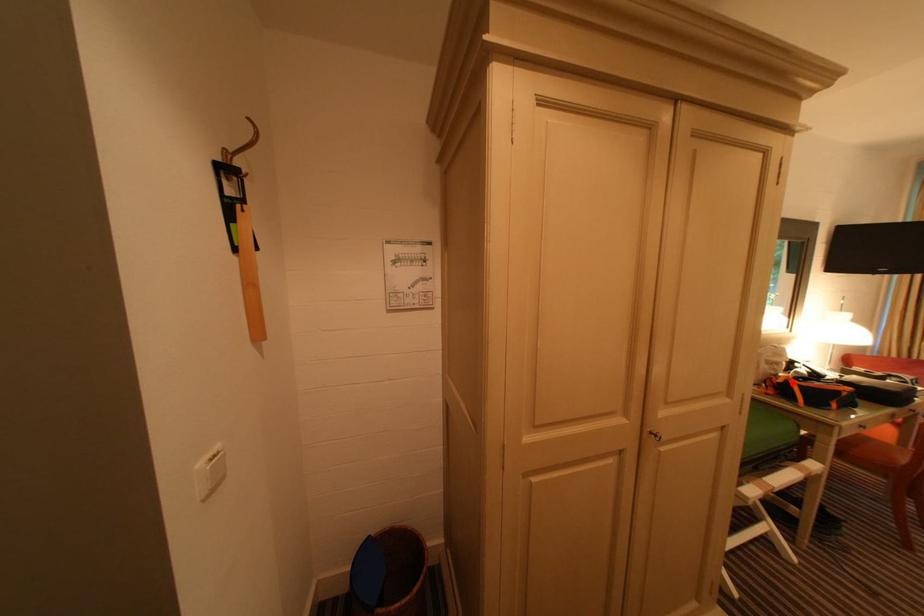
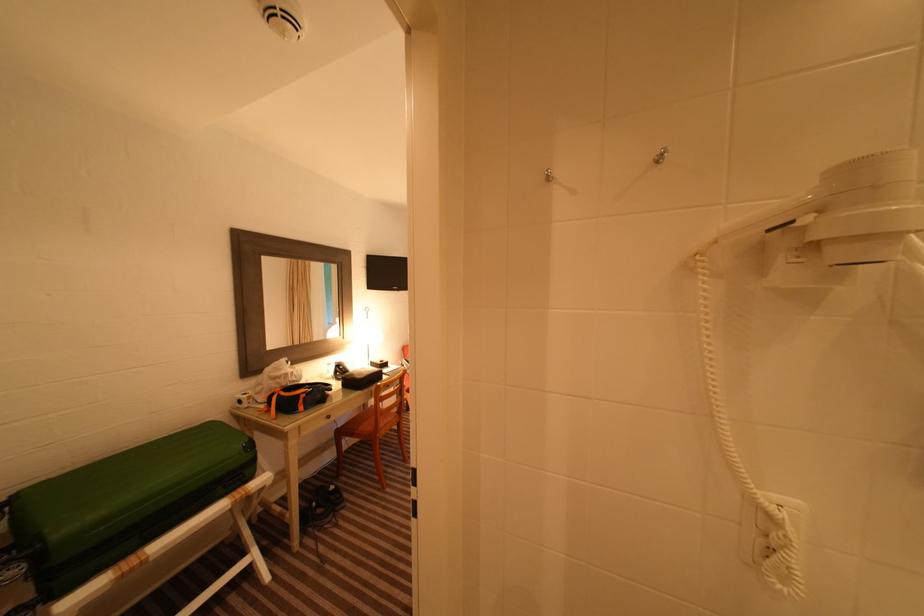
Where in the second image is the point corresponding to the highlighted location from the first image?

(280, 397)